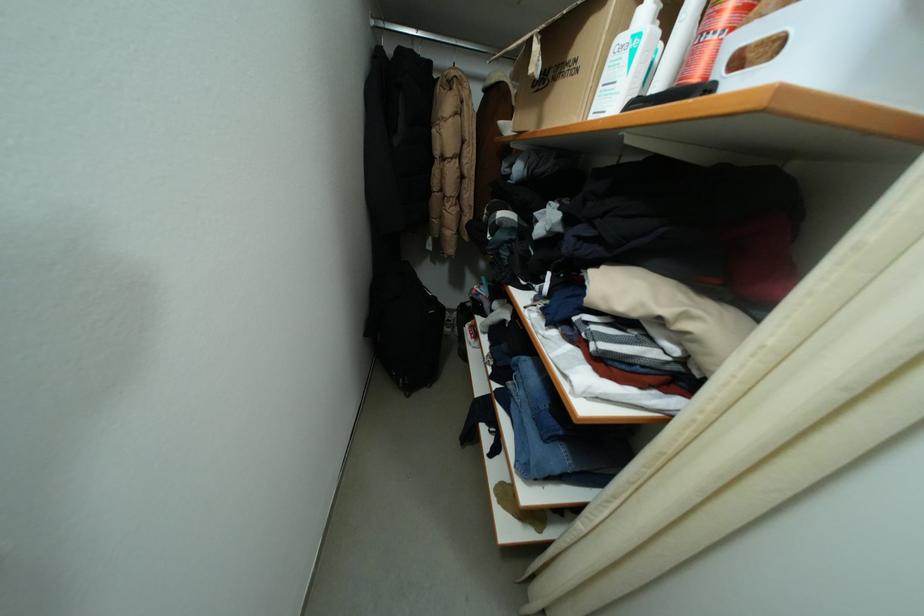
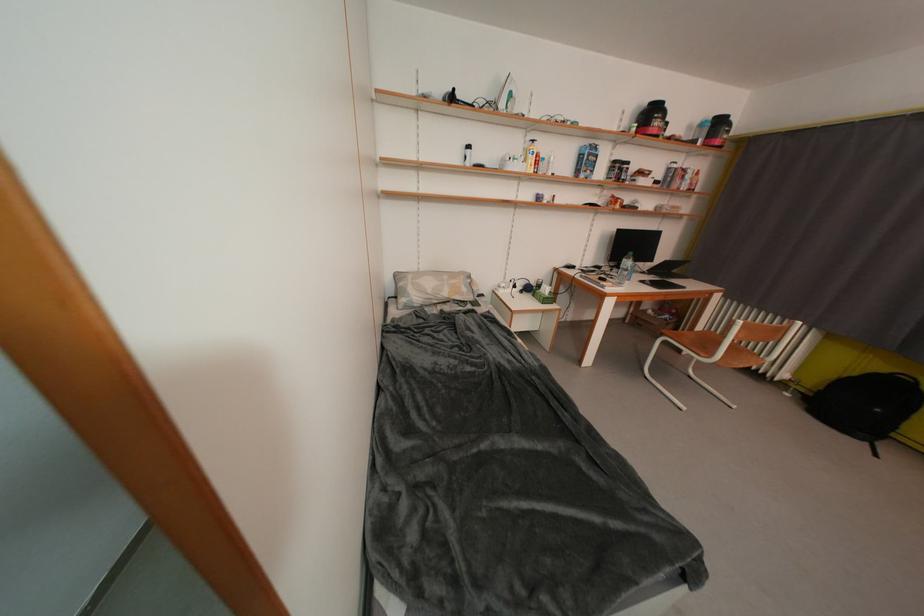
Question: In a continuous first-person perspective shot, in which direction is the camera moving?

Choices:
 (A) Left
 (B) Right
 (C) Forward
 (D) Backward

Answer: (B)